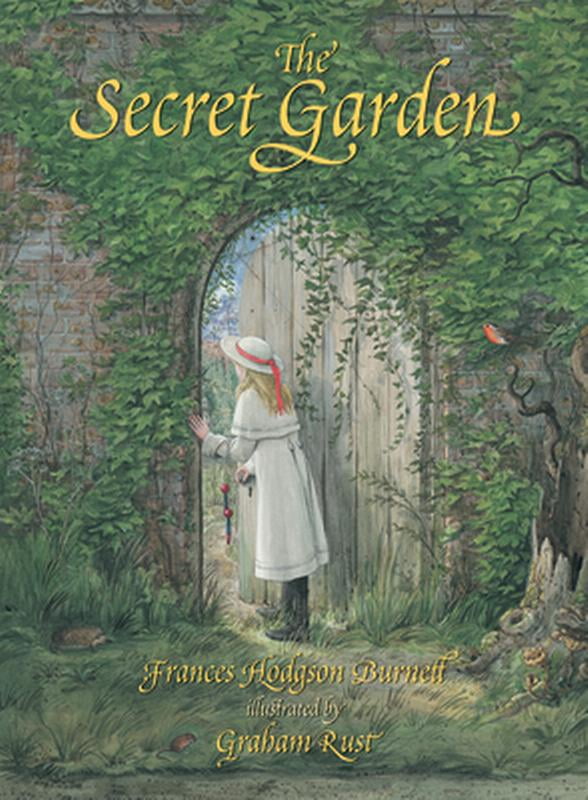
At what (x,y) coordinates should I click in order to perform the action: click on door. Please return your answer as a coordinate pair (x, y). The height and width of the screenshot is (800, 588). Looking at the image, I should click on (364, 417).